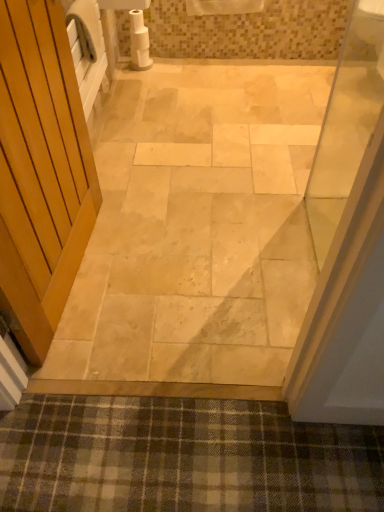
Question: Do you think white matte toilet paper at upper center is within natural stone floor at center, or outside of it?

Choices:
 (A) outside
 (B) inside

Answer: (A)

Question: From the image's perspective, relative to natural stone floor at center, is white matte toilet paper at upper center above or below?

Choices:
 (A) above
 (B) below

Answer: (A)

Question: Estimate the real-world distances between objects in this image. Which object is farther from the plaid fabric bath mat at lower center?

Choices:
 (A) white matte toilet paper at upper center
 (B) natural stone floor at center

Answer: (A)

Question: Which object is the closest to the white matte toilet paper at upper center?

Choices:
 (A) natural stone floor at center
 (B) plaid fabric bath mat at lower center

Answer: (A)